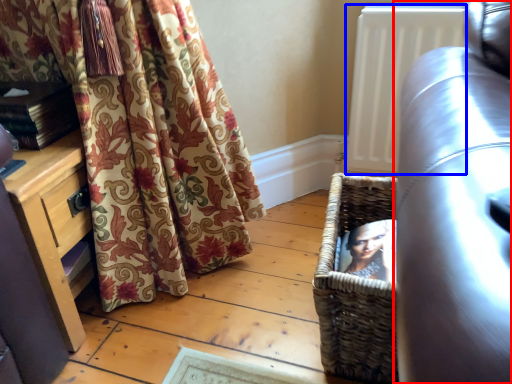
Question: Which object is further to the camera taking this photo, studio couch (highlighted by a red box) or radiator (highlighted by a blue box)?

Choices:
 (A) studio couch
 (B) radiator

Answer: (B)